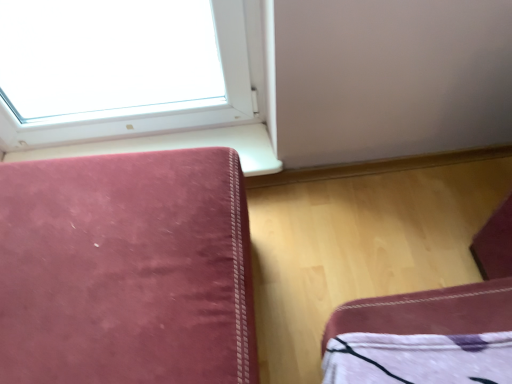
Question: Is velvet-like pink cushion at lower left in front of or behind velvet-like pink sofa at left in the image?

Choices:
 (A) behind
 (B) front

Answer: (A)

Question: From the image's perspective, is velvet-like pink cushion at lower left located above or below velvet-like pink sofa at left?

Choices:
 (A) above
 (B) below

Answer: (A)

Question: In terms of width, does velvet-like pink cushion at lower left look wider or thinner when compared to velvet-like pink sofa at left?

Choices:
 (A) thin
 (B) wide

Answer: (A)

Question: In the image, is velvet-like pink sofa at left on the left side or the right side of velvet-like pink cushion at lower left?

Choices:
 (A) left
 (B) right

Answer: (A)

Question: Considering the positions of velvet-like pink sofa at left and velvet-like pink cushion at lower left in the image, is velvet-like pink sofa at left wider or thinner than velvet-like pink cushion at lower left?

Choices:
 (A) wide
 (B) thin

Answer: (A)

Question: From a real-world perspective, is velvet-like pink sofa at left above or below velvet-like pink cushion at lower left?

Choices:
 (A) below
 (B) above

Answer: (B)

Question: From the image's perspective, is velvet-like pink sofa at left located above or below velvet-like pink cushion at lower left?

Choices:
 (A) above
 (B) below

Answer: (B)